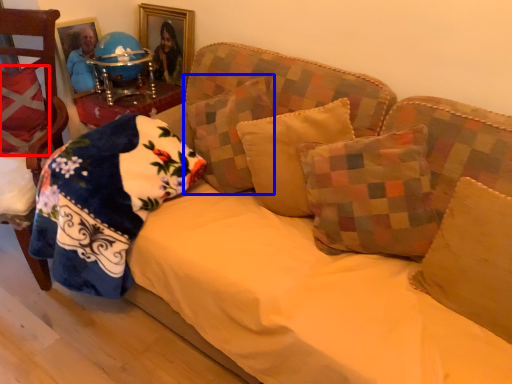
Question: Which object appears farthest to the camera in this image, pillow (highlighted by a red box) or pillow (highlighted by a blue box)?

Choices:
 (A) pillow
 (B) pillow

Answer: (A)